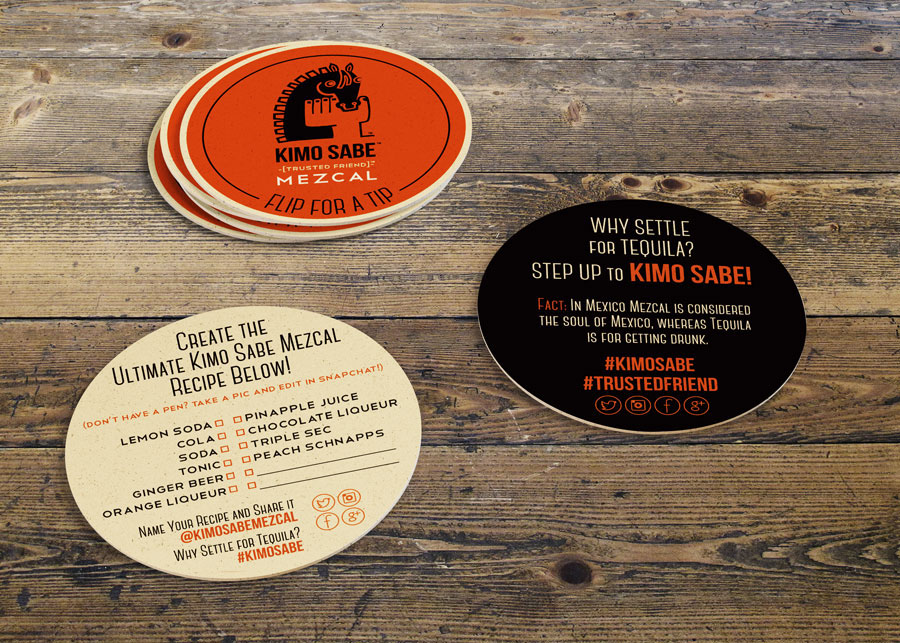
Identify the location of darkest coaster background color. (694, 509), (734, 361).